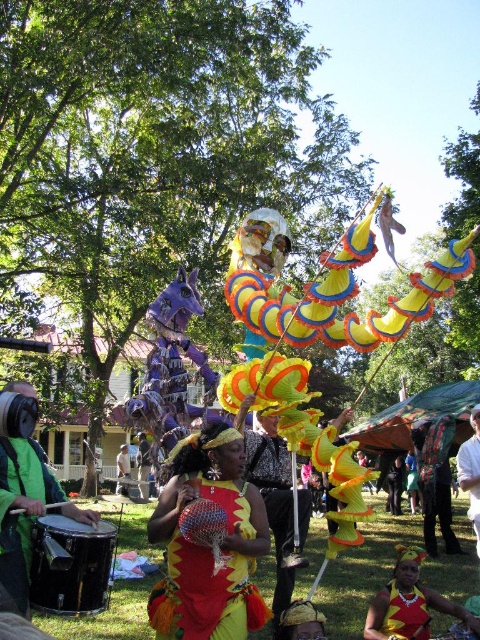
Is point (173, 492) farther from viewer compared to point (25, 492)?

Yes, point (173, 492) is farther from viewer.

Looking at this image, who is positioned more to the right, shiny yellow fabric at center or green matte drum at left?

shiny yellow fabric at center

Who is more distant from viewer, (216, 625) or (19, 570)?

The point (216, 625) is more distant.

Locate an element on the screen. The width and height of the screenshot is (480, 640). shiny yellow fabric at center is located at coordinates (208, 541).

Does shiny yellow fabric at center appear under yellow fabric headdress at center?

No, shiny yellow fabric at center is not below yellow fabric headdress at center.

Does shiny yellow fabric at center appear on the left side of yellow fabric headdress at center?

Correct, you'll find shiny yellow fabric at center to the left of yellow fabric headdress at center.

Who is more distant from viewer, (191,451) or (402,602)?

Point (402,602)

Where is `shiny yellow fabric at center`? The width and height of the screenshot is (480, 640). shiny yellow fabric at center is located at coordinates (208, 541).

Is green matte drum at left further to camera compared to white cotton shirt at center?

That is False.

Who is lower down, green matte drum at left or white cotton shirt at center?

white cotton shirt at center

At what (x,y) coordinates should I click in order to perform the action: click on green matte drum at left. Please return your answer as a coordinate pair (x, y). The image size is (480, 640). Looking at the image, I should click on (25, 512).